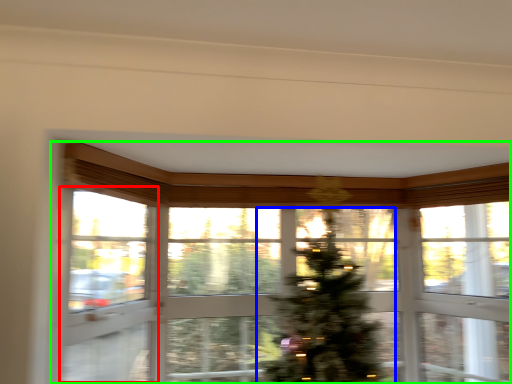
Question: Which object is positioned closest to screen door (highlighted by a red box)? Select from christmas tree (highlighted by a blue box) and window (highlighted by a green box).

Choices:
 (A) christmas tree
 (B) window

Answer: (B)